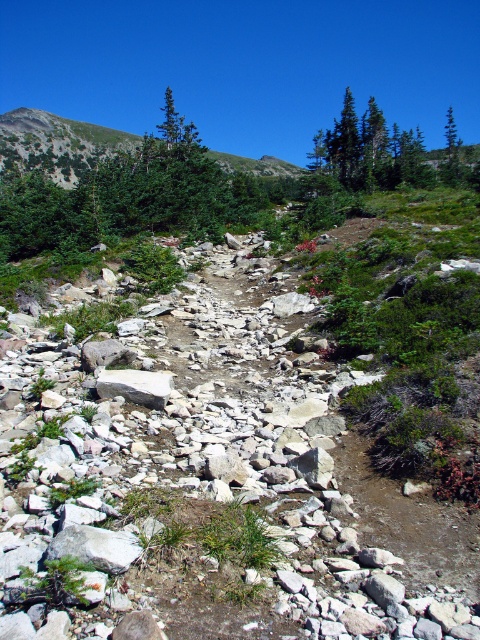
You are hiking along the rocky trail and want to take a photo of the green matte tree at upper center. Based on its position, in which direction should you face to capture it in your camera view?

The green matte tree at upper center is located at point coordinates, so you should face the upper center direction to capture it in your camera view.